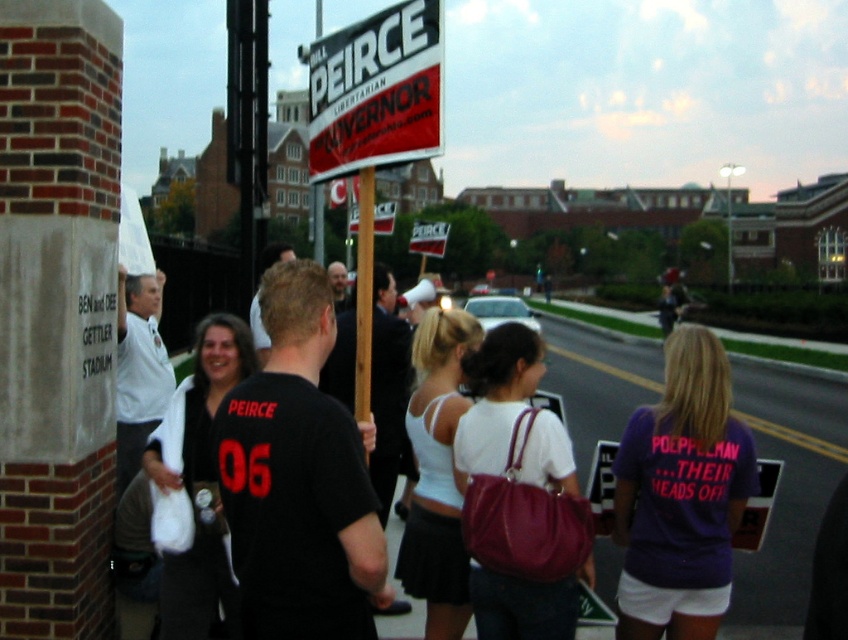
Between point (326, 376) and point (143, 362), which one is positioned in front?

Point (143, 362)

Is black matte shirt at center wider than white shirt at left?

Correct, the width of black matte shirt at center exceeds that of white shirt at left.

Does point (395, 420) lie behind point (124, 358)?

Yes, point (395, 420) is farther from viewer.

Locate an element on the screen. The width and height of the screenshot is (848, 640). black matte shirt at center is located at coordinates (388, 388).

Between black matte shirt at center and white plastic sign at center, which one has more height?

white plastic sign at center

Describe the element at coordinates (388, 388) in the screenshot. The height and width of the screenshot is (640, 848). I see `black matte shirt at center` at that location.

Is point (372, 358) positioned behind point (414, 234)?

No, it is not.

Locate an element on the screen. This screenshot has width=848, height=640. black matte shirt at center is located at coordinates (388, 388).

Does wooden pole at center have a larger size compared to dark brown hair at center?

No.

Identify the location of wooden pole at center. This screenshot has height=640, width=848. (364, 305).

Is point (367, 353) positioned in front of point (332, 266)?

That is True.

Locate an element on the screen. wooden pole at center is located at coordinates 364,305.